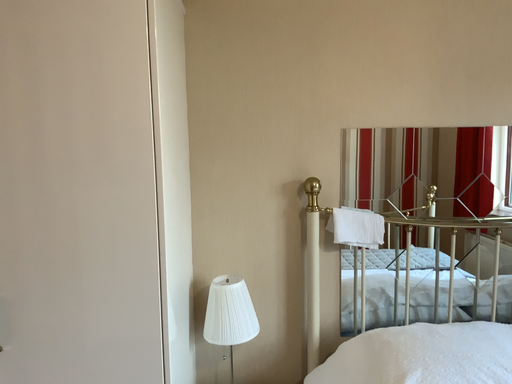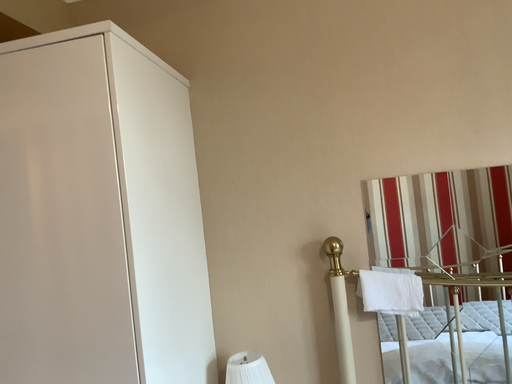
Question: Which way did the camera rotate in the video?

Choices:
 (A) rotated right
 (B) rotated left

Answer: (B)